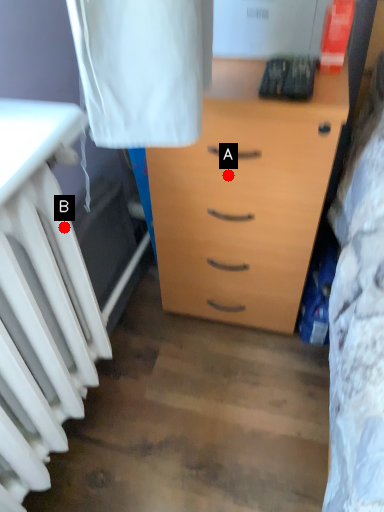
Question: Two points are circled on the image, labeled by A and B beside each circle. Among these points, which one is farthest from the camera?

Choices:
 (A) A is further
 (B) B is further

Answer: (A)